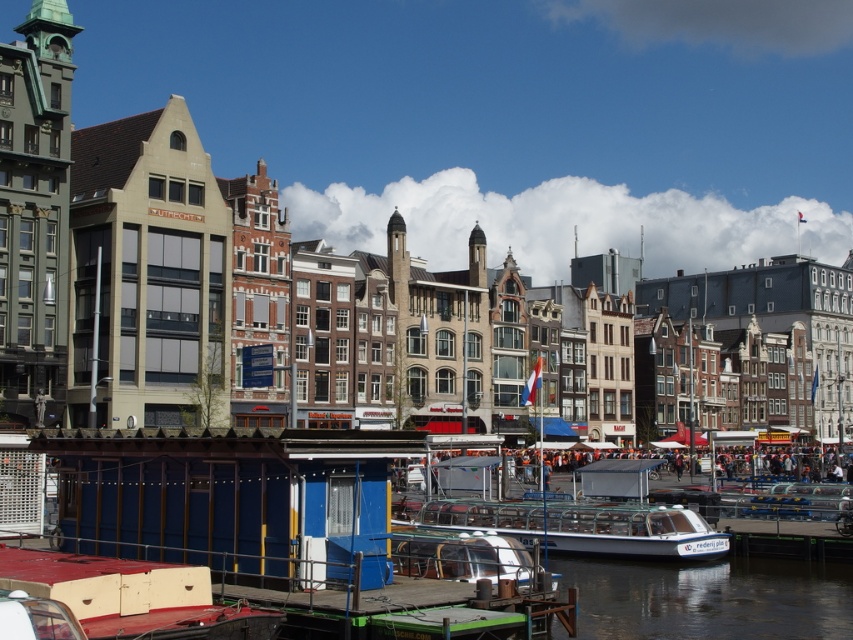
Question: Which point appears closest to the camera in this image?

Choices:
 (A) (631, 540)
 (B) (756, 467)

Answer: (A)

Question: Does white glossy boat at center appear on the left side of orange fabric crowd at center?

Choices:
 (A) yes
 (B) no

Answer: (A)

Question: Is white glossy boat at center below orange fabric crowd at center?

Choices:
 (A) no
 (B) yes

Answer: (A)

Question: Observing the image, what is the correct spatial positioning of white glossy boat at center in reference to orange fabric crowd at center?

Choices:
 (A) below
 (B) above

Answer: (B)

Question: Which point is closer to the camera taking this photo?

Choices:
 (A) (604, 502)
 (B) (751, 460)

Answer: (A)

Question: Among these objects, which one is nearest to the camera?

Choices:
 (A) orange fabric crowd at center
 (B) white glossy boat at center

Answer: (B)